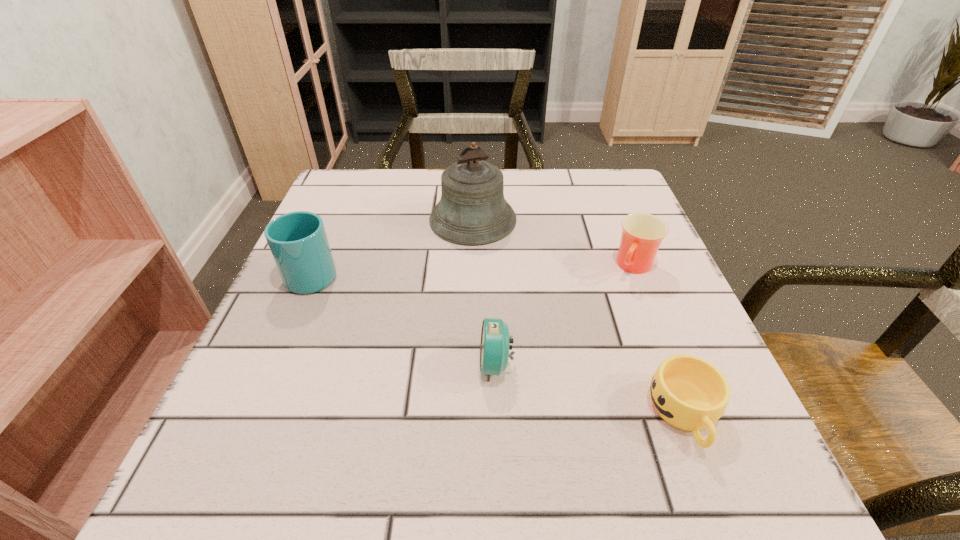
Find the location of a particular element. The image size is (960, 540). object present at the near right corner is located at coordinates (688, 392).

This screenshot has width=960, height=540. I want to click on free space at the far edge, so click(426, 180).

In the image, there is a desktop. Identify the location of free space at the left edge. The image size is (960, 540). (259, 403).

Find the location of a particular element. This screenshot has height=540, width=960. vacant space at the right edge is located at coordinates (624, 392).

You are a GUI agent. You are given a task and a screenshot of the screen. Output one action in this format:
    pyautogui.click(x=<x>, y=<y>)
    Task: Click on the free space at the far left corner
    
    Given the screenshot: What is the action you would take?
    pyautogui.click(x=333, y=185)

In the image, there is a desktop. Where is `free region at the near left corner`? free region at the near left corner is located at coordinates (182, 505).

Where is `empty location between the second tallest cup and the shortest object`? The height and width of the screenshot is (540, 960). empty location between the second tallest cup and the shortest object is located at coordinates (660, 340).

This screenshot has height=540, width=960. In order to click on empty space between the leftmost cup and the tallest object in this screenshot , I will do `click(394, 246)`.

Locate an element on the screen. free space between the alarm clock and the shortest cup is located at coordinates (590, 389).

Locate an element on the screen. This screenshot has height=540, width=960. free point between the bell and the leftmost object is located at coordinates (394, 246).